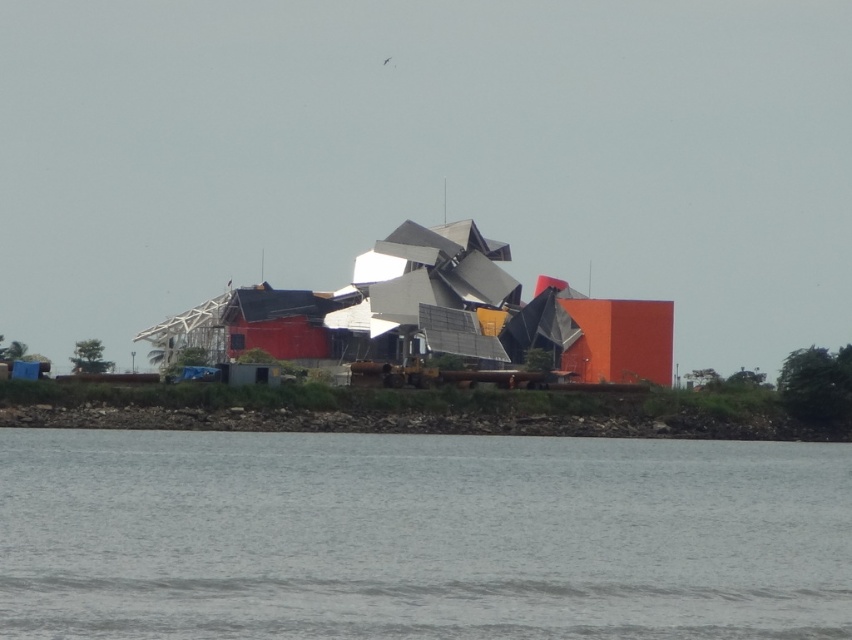
You are a construction worker standing at the edge of the gray water at lower center and brown dirt at lower center. You need to move a heavy equipment from the gray water to the brown dirt. Which direction should you move the equipment to reach the brown dirt?

The gray water at lower center is narrower than the brown dirt at lower center, so you should move the equipment to the right or left to reach the brown dirt.

You are standing at the edge of the water in the scene and want to reach both the point labeled as point (384,456) and the point labeled as point (176,417). Which point will you reach first as you move forward?

You will reach point (384,456) first because it is closer to you than point (176,417).